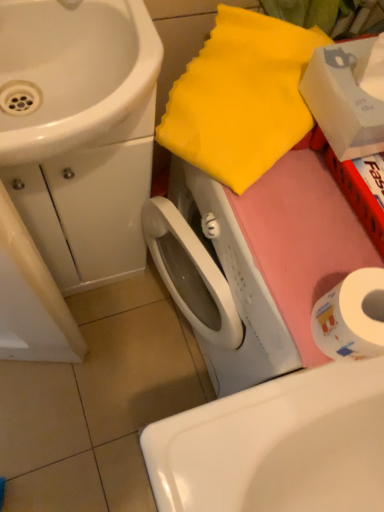
Locate an element on the screen. yellow fabric at upper right is located at coordinates (241, 98).

Measure the distance between point (351, 73) and camera.

The depth of point (351, 73) is 22.64 inches.

At what (x,y) coordinates should I click in order to perform the action: click on yellow fabric at upper right. Please return your answer as a coordinate pair (x, y). The image size is (384, 512). Looking at the image, I should click on pyautogui.click(x=241, y=98).

Is white cardboard box at upper right located outside white paper at lower right?

Yes, white cardboard box at upper right is not within white paper at lower right.

Could you tell me if white cardboard box at upper right is facing white paper at lower right?

No.

Is white cardboard box at upper right positioned before white paper at lower right?

Yes, it is in front of white paper at lower right.

Considering the points (351, 46) and (113, 185), which point is in front, point (351, 46) or point (113, 185)?

The point (351, 46) is in front.

Is white cardboard box at upper right facing away from white glossy sink at upper left, which is the first sink from top to bottom?

No.

Does white cardboard box at upper right lie behind white glossy sink at upper left, which is the first sink from top to bottom?

No, white cardboard box at upper right is in front of white glossy sink at upper left, which is the first sink from top to bottom.

Which object is thinner, white cardboard box at upper right or white glossy sink at upper left, which ranks as the second sink in right-to-left order?

With smaller width is white cardboard box at upper right.

Is yellow fabric at upper right at the left side of white glossy sink at upper left, which ranks as the second sink in right-to-left order?

No.

Considering the sizes of objects yellow fabric at upper right and white glossy sink at upper left, which is the first sink from top to bottom, in the image provided, who is taller, yellow fabric at upper right or white glossy sink at upper left, which is the first sink from top to bottom,?

With more height is white glossy sink at upper left, which is the first sink from top to bottom.

Which object is closer to the camera taking this photo, yellow fabric at upper right or white glossy sink at upper left, the 2th sink positioned from the bottom?

Positioned in front is white glossy sink at upper left, the 2th sink positioned from the bottom.

Is white glossy sink at upper left, placed as the 1th sink when sorted from left to right, at the back of yellow fabric at upper right?

No, yellow fabric at upper right is not facing away from white glossy sink at upper left, placed as the 1th sink when sorted from left to right.

Which is less distant, [359,357] or [136,88]?

Positioned in front is point [136,88].

Could you tell me if white paper at lower right is turned towards white glossy sink at upper left, the 2th sink positioned from the bottom?

No, white paper at lower right is not oriented towards white glossy sink at upper left, the 2th sink positioned from the bottom.

From the image's perspective, who appears lower, white paper at lower right or white glossy sink at upper left, placed as the 1th sink when sorted from left to right?

white paper at lower right.

From a real-world perspective, who is located lower, white paper at lower right or white glossy sink at upper left, which ranks as the second sink in right-to-left order?

white glossy sink at upper left, which ranks as the second sink in right-to-left order, is physically lower.

Can you tell me how much yellow fabric at upper right and white glossy sink at lower center, positioned as the 1th sink in right-to-left order, differ in facing direction?

25.3 degrees separate the facing orientations of yellow fabric at upper right and white glossy sink at lower center, positioned as the 1th sink in right-to-left order.

Is yellow fabric at upper right oriented towards white glossy sink at lower center, which is the 2th sink in left-to-right order?

No.

Considering the relative sizes of yellow fabric at upper right and white glossy sink at lower center, positioned as the 1th sink in right-to-left order, in the image provided, is yellow fabric at upper right smaller than white glossy sink at lower center, positioned as the 1th sink in right-to-left order,?

Correct, yellow fabric at upper right occupies less space than white glossy sink at lower center, positioned as the 1th sink in right-to-left order.

Image resolution: width=384 pixels, height=512 pixels. What are the coordinates of `the 2nd sink below the yellow fabric at upper right (from the image's perspective)` in the screenshot? It's located at (276, 445).

Is white glossy sink at lower center, which is the 2th sink in left-to-right order, bigger than yellow fabric at upper right?

Yes, white glossy sink at lower center, which is the 2th sink in left-to-right order, is bigger than yellow fabric at upper right.

Is yellow fabric at upper right located within white glossy sink at lower center, which is the 2th sink in left-to-right order?

No, yellow fabric at upper right is not surrounded by white glossy sink at lower center, which is the 2th sink in left-to-right order.

Could you measure the distance between white glossy sink at lower center, which is counted as the 1th sink, starting from the bottom, and yellow fabric at upper right?

The distance of white glossy sink at lower center, which is counted as the 1th sink, starting from the bottom, from yellow fabric at upper right is 48.92 centimeters.

From the picture: From the image's perspective, would you say white glossy sink at lower center, which is counted as the 1th sink, starting from the bottom, is positioned over yellow fabric at upper right?

No, from the image's perspective, white glossy sink at lower center, which is counted as the 1th sink, starting from the bottom, is not over yellow fabric at upper right.

Is white paper at lower right taller or shorter than white cardboard box at upper right?

In the image, white paper at lower right appears to be shorter than white cardboard box at upper right.

From the image's perspective, is white paper at lower right on white cardboard box at upper right?

Incorrect, from the image's perspective, white paper at lower right is lower than white cardboard box at upper right.

Looking at the image, does white paper at lower right seem bigger or smaller compared to white cardboard box at upper right?

white paper at lower right is smaller than white cardboard box at upper right.

Does white paper at lower right turn towards white cardboard box at upper right?

No, white paper at lower right is not oriented towards white cardboard box at upper right.

In the image, there is a white cardboard box at upper right. At what (x,y) coordinates should I click in order to perform the action: click on toilet paper below it (from a real-world perspective). Please return your answer as a coordinate pair (x, y). This screenshot has height=512, width=384. Looking at the image, I should click on (351, 317).

The height and width of the screenshot is (512, 384). Identify the location of box lying above the white glossy sink at upper left, placed as the 1th sink when sorted from left to right (from the image's perspective). (347, 96).

Considering their positions, is white glossy sink at upper left, placed as the 1th sink when sorted from left to right, positioned closer to yellow fabric at upper right than white paper at lower right?

white glossy sink at upper left, placed as the 1th sink when sorted from left to right, lies closer to yellow fabric at upper right than the other object.

From the picture: Estimate the real-world distances between objects in this image. Which object is closer to white cardboard box at upper right, white paper at lower right or yellow fabric at upper right?

Among the two, yellow fabric at upper right is located nearer to white cardboard box at upper right.

When comparing their distances from white glossy sink at upper left, which is the first sink from top to bottom, does white paper at lower right or white glossy sink at lower center, which is the 2th sink in left-to-right order, seem closer?

Based on the image, white paper at lower right appears to be nearer to white glossy sink at upper left, which is the first sink from top to bottom.

From the image, which object appears to be nearer to white glossy sink at upper left, which ranks as the second sink in right-to-left order, white cardboard box at upper right or yellow fabric at upper right?

yellow fabric at upper right is closer to white glossy sink at upper left, which ranks as the second sink in right-to-left order.

Based on their spatial positions, is yellow fabric at upper right or white cardboard box at upper right closer to white glossy sink at lower center, which ranks as the second sink in top-to-bottom order?

yellow fabric at upper right.

Which object lies further to the anchor point yellow fabric at upper right, white glossy sink at lower center, which ranks as the second sink in top-to-bottom order, or white cardboard box at upper right?

white glossy sink at lower center, which ranks as the second sink in top-to-bottom order, lies further to yellow fabric at upper right than the other object.

When comparing their distances from white glossy sink at lower center, which is the 2th sink in left-to-right order, does white cardboard box at upper right or yellow fabric at upper right seem further?

white cardboard box at upper right is further to white glossy sink at lower center, which is the 2th sink in left-to-right order.

From the image, which object appears to be farther from white paper at lower right, white cardboard box at upper right or yellow fabric at upper right?

Among the two, yellow fabric at upper right is located further to white paper at lower right.

Find the location of a particular element. beach towel between white glossy sink at upper left, which is the first sink from top to bottom, and white cardboard box at upper right from left to right is located at coordinates (241, 98).

Identify the location of box between yellow fabric at upper right and white glossy sink at lower center, which is the 2th sink in left-to-right order, in the up-down direction. This screenshot has height=512, width=384. (347, 96).

Locate an element on the screen. The width and height of the screenshot is (384, 512). toilet paper between yellow fabric at upper right and white glossy sink at lower center, positioned as the 1th sink in right-to-left order, vertically is located at coordinates (351, 317).

Identify the location of box that lies between yellow fabric at upper right and white paper at lower right from top to bottom. (x=347, y=96).